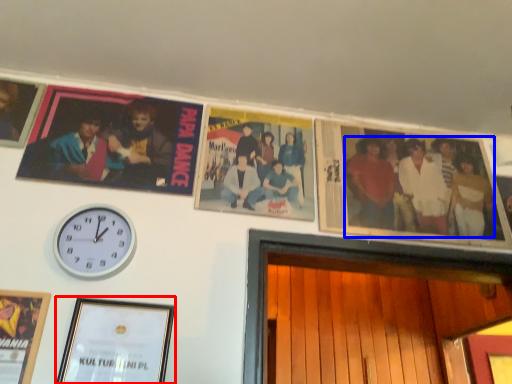
Question: Which point is closer to the camera, picture frame (highlighted by a red box) or person (highlighted by a blue box)?

Choices:
 (A) picture frame
 (B) person

Answer: (A)